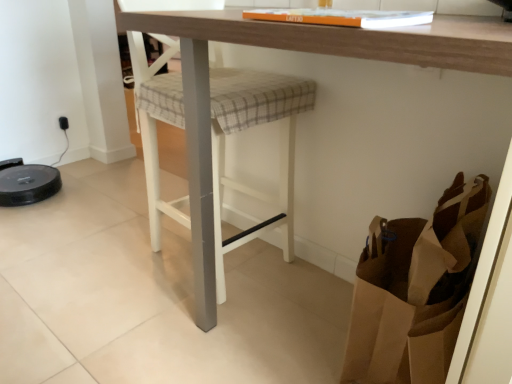
Question: Would you consider brown paper bag at lower right to be distant from wooden table at center?

Choices:
 (A) no
 (B) yes

Answer: (A)

Question: From the image's perspective, would you say brown paper bag at lower right is shown under wooden table at center?

Choices:
 (A) no
 (B) yes

Answer: (B)

Question: Does brown paper bag at lower right lie behind wooden table at center?

Choices:
 (A) no
 (B) yes

Answer: (B)

Question: From a real-world perspective, is brown paper bag at lower right over wooden table at center?

Choices:
 (A) no
 (B) yes

Answer: (A)

Question: Does brown paper bag at lower right have a larger size compared to wooden table at center?

Choices:
 (A) no
 (B) yes

Answer: (A)

Question: Is brown paper bag at lower right shorter than wooden table at center?

Choices:
 (A) yes
 (B) no

Answer: (A)

Question: Is wooden table at center far away from plaid fabric step stool at center?

Choices:
 (A) no
 (B) yes

Answer: (A)

Question: Considering the relative sizes of wooden table at center and plaid fabric step stool at center in the image provided, is wooden table at center taller than plaid fabric step stool at center?

Choices:
 (A) yes
 (B) no

Answer: (B)

Question: Is wooden table at center not inside plaid fabric step stool at center?

Choices:
 (A) no
 (B) yes

Answer: (B)

Question: Considering the relative sizes of wooden table at center and plaid fabric step stool at center in the image provided, is wooden table at center wider than plaid fabric step stool at center?

Choices:
 (A) yes
 (B) no

Answer: (A)

Question: Is plaid fabric step stool at center a part of wooden table at center?

Choices:
 (A) yes
 (B) no

Answer: (B)

Question: Is wooden table at center closer to camera compared to plaid fabric step stool at center?

Choices:
 (A) yes
 (B) no

Answer: (A)

Question: Does wooden table at center come in front of brown paper bag at lower right?

Choices:
 (A) yes
 (B) no

Answer: (A)